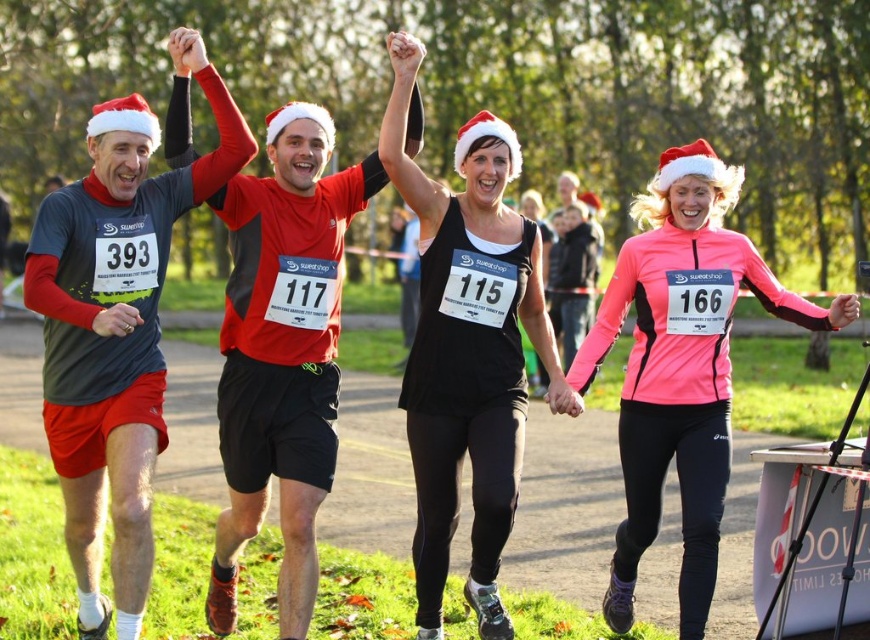
Question: Which of the following is the closest to the observer?

Choices:
 (A) pink matte jacket at center
 (B) red matte jersey at center

Answer: (B)

Question: Is matte gray shirt at center smaller than red matte jersey at center?

Choices:
 (A) no
 (B) yes

Answer: (B)

Question: Where is red matte jersey at center located in relation to black matte tank top at center in the image?

Choices:
 (A) left
 (B) right

Answer: (A)

Question: Among these points, which one is nearest to the camera?

Choices:
 (A) (118, 580)
 (B) (687, 572)

Answer: (A)

Question: Does black matte tank top at center have a smaller size compared to pink matte jacket at center?

Choices:
 (A) yes
 (B) no

Answer: (A)

Question: Which point is farther to the camera?

Choices:
 (A) click(x=700, y=508)
 (B) click(x=174, y=76)

Answer: (B)